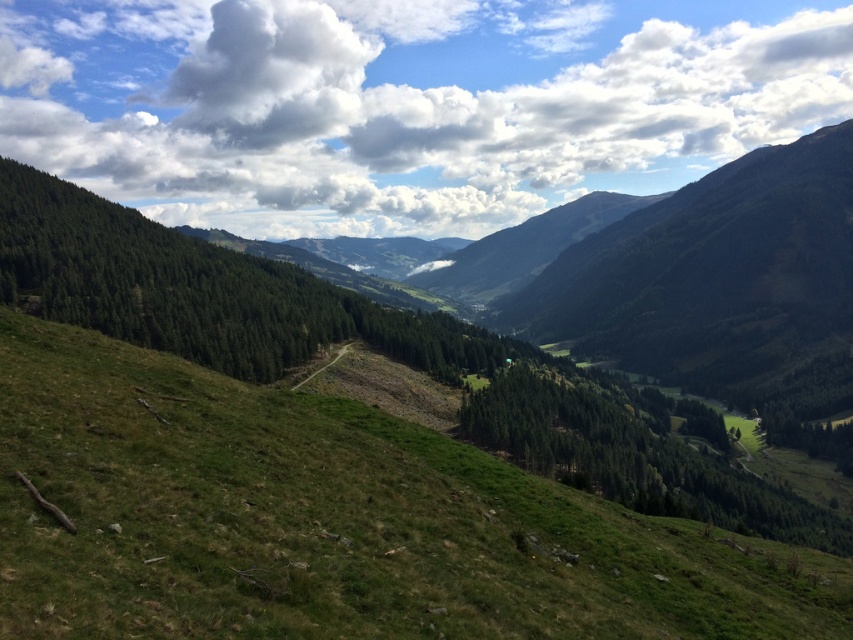
Identify the location of green grassy slope at lower left. The width and height of the screenshot is (853, 640). (332, 522).

Is green grassy slope at lower left positioned at the back of white fluffy cloud at upper center?

That is False.

Does point (74, 474) come in front of point (402, 148)?

Yes, it is in front of point (402, 148).

Where is `green grassy slope at lower left`? The image size is (853, 640). green grassy slope at lower left is located at coordinates (332, 522).